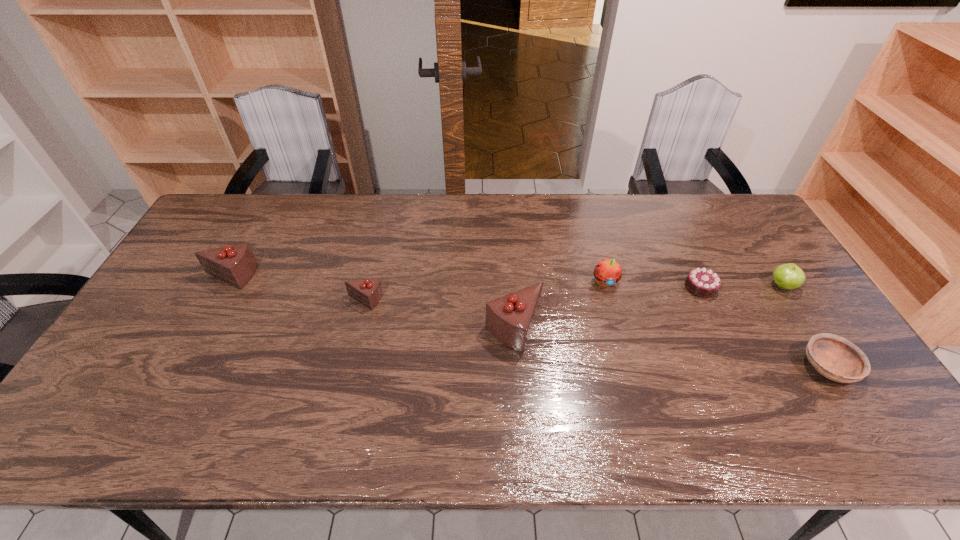
You are a GUI agent. You are given a task and a screenshot of the screen. Output one action in this format:
    pyautogui.click(x=<x>, y=<y>)
    Task: Click on the free space between the shortest chocolate cake and the bowl
    The height and width of the screenshot is (540, 960).
    Given the screenshot: What is the action you would take?
    pyautogui.click(x=764, y=327)

Where is `vacant space that's between the right apple and the third tallest chocolate cake`? The image size is (960, 540). vacant space that's between the right apple and the third tallest chocolate cake is located at coordinates coord(573,293).

Find the location of a particular element. The height and width of the screenshot is (540, 960). vacant area between the sixth object from right to left and the left apple is located at coordinates (484, 291).

Where is `empty location between the second chocolate cake from right to left and the bowl`? empty location between the second chocolate cake from right to left and the bowl is located at coordinates (671, 348).

The height and width of the screenshot is (540, 960). In order to click on empty space that is in between the leftmost chocolate cake and the fifth object from left to right in this screenshot , I will do `click(465, 281)`.

Identify the location of vacant area that lies between the second tallest chocolate cake and the fifth object from left to right. The image size is (960, 540). (465, 281).

This screenshot has width=960, height=540. Find the location of `empty space that is in between the fourth object from right to left and the third tallest chocolate cake`. empty space that is in between the fourth object from right to left and the third tallest chocolate cake is located at coordinates (484, 291).

At what (x,y) coordinates should I click in order to perform the action: click on object that stands as the second closest to the second tallest object. Please return your answer as a coordinate pair (x, y). Looking at the image, I should click on (510, 318).

Locate an element on the screen. This screenshot has height=540, width=960. object that is the fourth closest to the left apple is located at coordinates (789, 276).

Locate an element on the screen. The height and width of the screenshot is (540, 960). chocolate cake that is the closest to the fourth object from right to left is located at coordinates (510, 318).